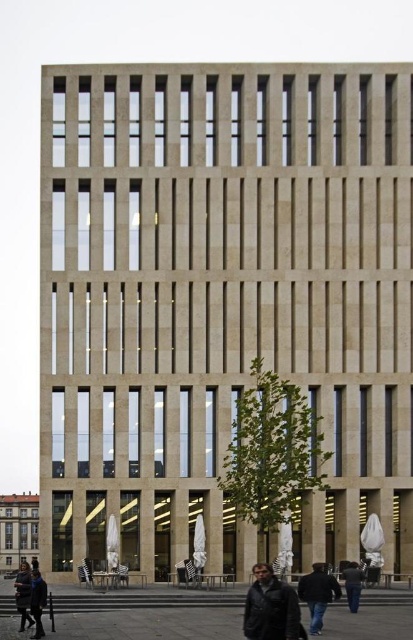
Can you confirm if dark gray leather jacket at lower center is wider than dark gray jacket at lower center?

In fact, dark gray leather jacket at lower center might be narrower than dark gray jacket at lower center.

The width and height of the screenshot is (413, 640). What are the coordinates of `dark gray leather jacket at lower center` in the screenshot? It's located at point(270,608).

Does point (285, 620) come behind point (353, 588)?

No, it is in front of (353, 588).

Image resolution: width=413 pixels, height=640 pixels. In order to click on dark gray leather jacket at lower center in this screenshot , I will do `click(270, 608)`.

Between dark brown leather jacket at lower left and dark blue leather jacket at lower left, which one is positioned higher?

dark blue leather jacket at lower left is higher up.

Between dark brown leather jacket at lower left and dark blue leather jacket at lower left, which one has less height?

Standing shorter between the two is dark blue leather jacket at lower left.

This screenshot has height=640, width=413. I want to click on dark brown leather jacket at lower left, so click(x=23, y=595).

Where is `dark brown leather jacket at lower left`? This screenshot has height=640, width=413. dark brown leather jacket at lower left is located at coordinates (23, 595).

Is dark blue jacket at center behind dark brown leather jacket at lower left?

No, dark blue jacket at center is closer to the viewer.

Who is lower down, dark blue jacket at center or dark brown leather jacket at lower left?

dark brown leather jacket at lower left is lower down.

Does point (310, 589) come closer to viewer compared to point (21, 595)?

Yes, point (310, 589) is closer to viewer.

This screenshot has height=640, width=413. I want to click on dark blue jacket at center, so click(x=318, y=595).